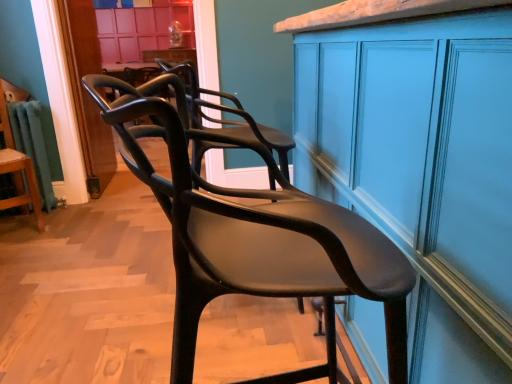
Question: Can you confirm if matte black chair at left, marked as the second chair in a right-to-left arrangement, is taller than matte black chair at center, positioned as the first chair in right-to-left order?

Choices:
 (A) no
 (B) yes

Answer: (B)

Question: Does matte black chair at left, which is counted as the first chair, starting from the left, touch matte black chair at center, placed as the first chair when sorted from front to back?

Choices:
 (A) yes
 (B) no

Answer: (B)

Question: Is matte black chair at left, the 1th chair from the back, oriented away from matte black chair at center, the 2th chair from the left?

Choices:
 (A) yes
 (B) no

Answer: (B)

Question: From a real-world perspective, does matte black chair at left, arranged as the 2th chair when viewed from the front, stand above matte black chair at center, positioned as the first chair in right-to-left order?

Choices:
 (A) yes
 (B) no

Answer: (B)

Question: Does matte black chair at left, marked as the second chair in a right-to-left arrangement, have a lesser height compared to matte black chair at center, placed as the first chair when sorted from front to back?

Choices:
 (A) yes
 (B) no

Answer: (B)

Question: Based on their sizes in the image, would you say matte black chair at left, arranged as the 2th chair when viewed from the front, is bigger or smaller than matte blue cabinet at center?

Choices:
 (A) big
 (B) small

Answer: (B)

Question: Considering the positions of matte black chair at left, arranged as the 2th chair when viewed from the front, and matte blue cabinet at center in the image, is matte black chair at left, arranged as the 2th chair when viewed from the front, wider or thinner than matte blue cabinet at center?

Choices:
 (A) wide
 (B) thin

Answer: (B)

Question: Relative to matte blue cabinet at center, is matte black chair at left, which is counted as the first chair, starting from the left, in front or behind?

Choices:
 (A) front
 (B) behind

Answer: (B)

Question: Which is correct: matte black chair at left, arranged as the 2th chair when viewed from the front, is inside matte blue cabinet at center, or outside of it?

Choices:
 (A) outside
 (B) inside

Answer: (A)

Question: Does point (20, 165) appear closer or farther from the camera than point (90, 94)?

Choices:
 (A) closer
 (B) farther

Answer: (B)

Question: From the image's perspective, relative to matte black chair at center, placed as the first chair when sorted from front to back, is matte black chair at left, the 1th chair from the back, above or below?

Choices:
 (A) above
 (B) below

Answer: (A)

Question: Do you think matte black chair at left, arranged as the 2th chair when viewed from the front, is within matte black chair at center, placed as the first chair when sorted from front to back, or outside of it?

Choices:
 (A) inside
 (B) outside

Answer: (B)

Question: Is matte black chair at left, which is counted as the first chair, starting from the left, taller or shorter than matte black chair at center, the second chair in the back-to-front sequence?

Choices:
 (A) tall
 (B) short

Answer: (A)

Question: Is matte blue cabinet at center bigger or smaller than matte black chair at center, the 2th chair from the left?

Choices:
 (A) big
 (B) small

Answer: (A)

Question: Choose the correct answer: Is matte blue cabinet at center inside matte black chair at center, placed as the first chair when sorted from front to back, or outside it?

Choices:
 (A) outside
 (B) inside

Answer: (A)